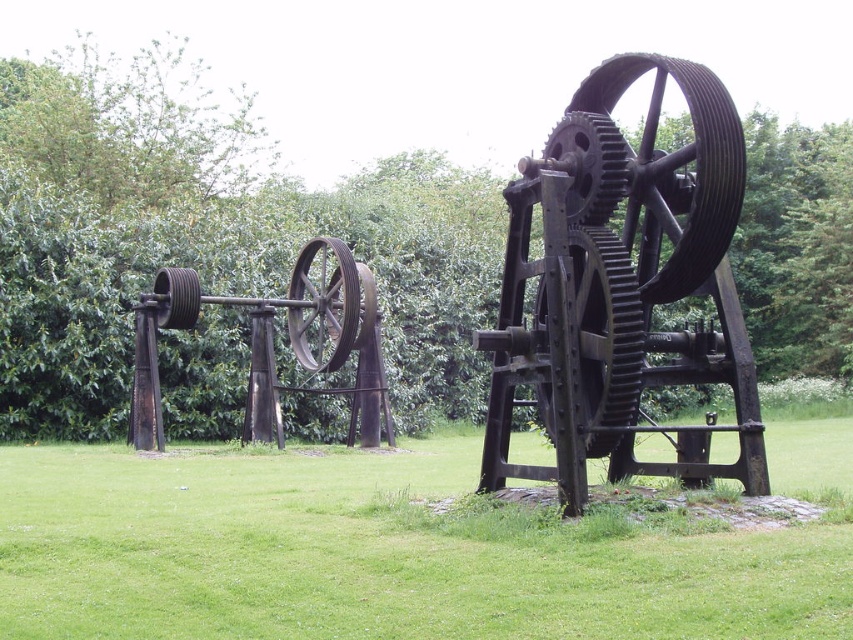
You are a maintenance worker checking the spacing between the rustic metal wheel at center and the rusty metal gear at center. According to the safety guidelines, the distance between them must be at least 1 meter to allow for safe maintenance access. Can you confirm if the current spacing meets this requirement?

The rustic metal wheel at center might be wider than rusty metal gear at center, but the description does not provide specific measurements of the distance between them. Without knowing the exact spacing, it is impossible to confirm if it meets the 1 meter safety requirement.

You are a park maintenance worker who needs to measure the distance between the two metal structures in the image. You have a measuring tape that can extend up to 30 feet. Can you measure the distance between the rustic metal wheel at center and the rusty metal gear at center without needing a longer tape?

The rustic metal wheel at center is 32.11 feet from the rusty metal gear at center. Since your measuring tape can only extend up to 30 feet, you cannot measure the distance between them without needing a longer tape.

You are standing in the park and see two points marked in the image. Which point is closer to you, point (537,444) or point (712,88)?

Point (712,88) is closer to you because point (537,444) is behind it.